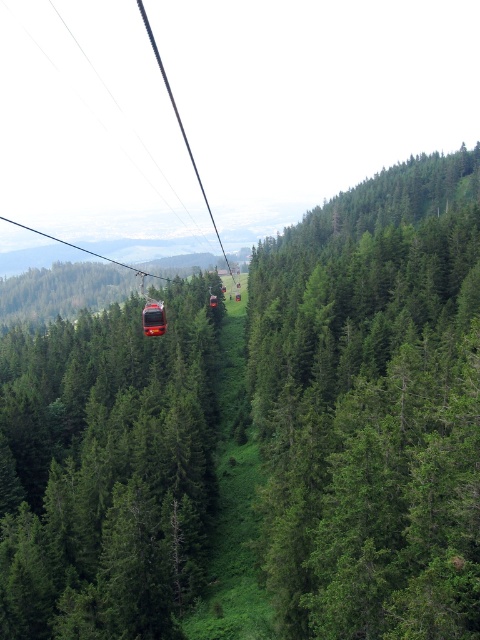
Question: Which point appears farthest from the camera in this image?

Choices:
 (A) click(x=152, y=307)
 (B) click(x=1, y=449)
 (C) click(x=457, y=461)

Answer: (B)

Question: Does green leafy tree at center have a lesser width compared to green matte tree at center?

Choices:
 (A) yes
 (B) no

Answer: (B)

Question: Which object is the closest to the green matte tree at center?

Choices:
 (A) metallic cable car at center
 (B) green leafy tree at center

Answer: (B)

Question: Is green leafy tree at center behind metallic cable car at center?

Choices:
 (A) yes
 (B) no

Answer: (B)

Question: Which object is farther from the camera taking this photo?

Choices:
 (A) green leafy tree at center
 (B) green matte tree at center
 (C) metallic cable car at center

Answer: (C)

Question: Does green leafy tree at center appear on the left side of metallic cable car at center?

Choices:
 (A) yes
 (B) no

Answer: (B)